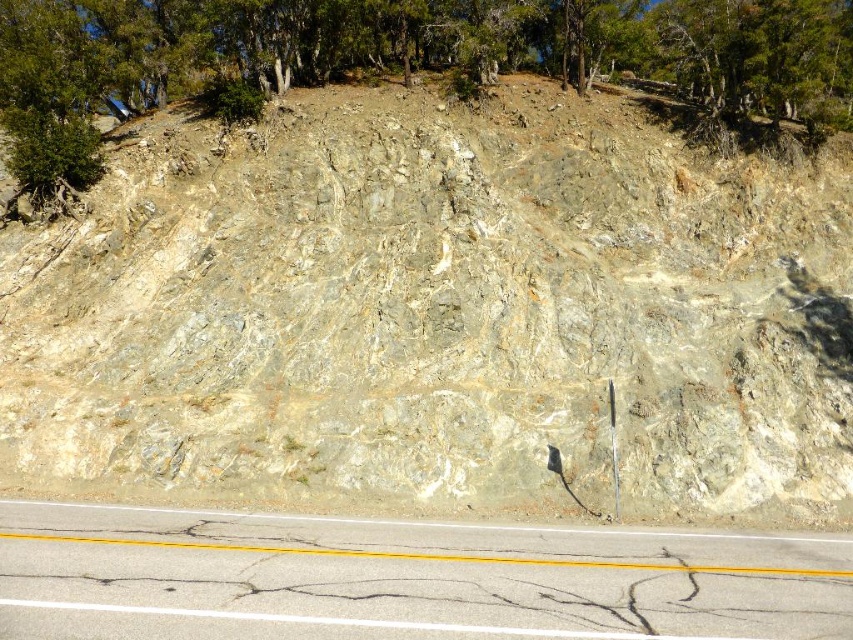
Between gray rock at center and green leafy tree at upper center, which one has more height?

Standing taller between the two is gray rock at center.

Does point (166, 348) come farther from viewer compared to point (816, 109)?

No, (166, 348) is closer to viewer.

Who is more distant from viewer, (96, 376) or (296, 38)?

The point (296, 38) is more distant.

Identify the location of gray rock at center. This screenshot has height=640, width=853. (437, 310).

Is point (222, 634) farther from camera compared to point (1, 35)?

No.

You are a GUI agent. You are given a task and a screenshot of the screen. Output one action in this format:
    pyautogui.click(x=<x>, y=<y>)
    Task: Click on the asphalt road at lower center
    The image size is (853, 640).
    Given the screenshot: What is the action you would take?
    pyautogui.click(x=404, y=579)

Between gray rock at center and asphalt road at lower center, which one appears on the right side from the viewer's perspective?

From the viewer's perspective, gray rock at center appears more on the right side.

Where is `gray rock at center`? The height and width of the screenshot is (640, 853). gray rock at center is located at coordinates (437, 310).

Find the location of a particular element. gray rock at center is located at coordinates (437, 310).

I want to click on gray rock at center, so click(x=437, y=310).